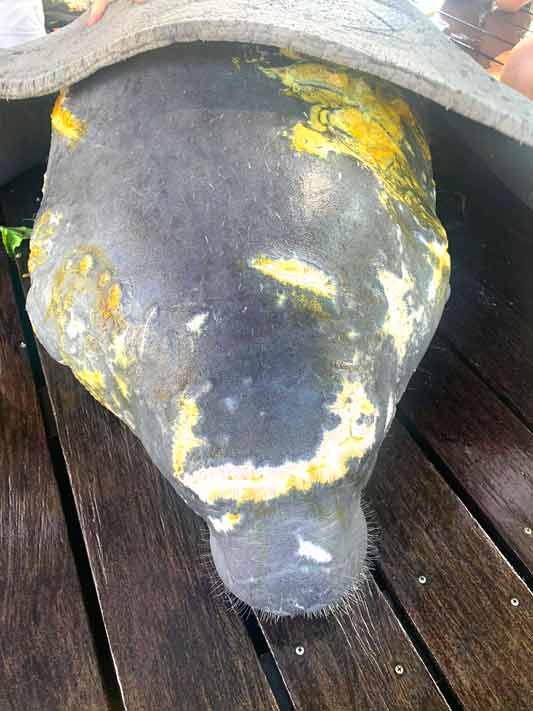
You are a GUI agent. You are given a task and a screenshot of the screen. Output one action in this format:
    pyautogui.click(x=<x>, y=<y>)
    Task: Click on the gray cover
    
    Given the screenshot: What is the action you would take?
    pyautogui.click(x=192, y=23)